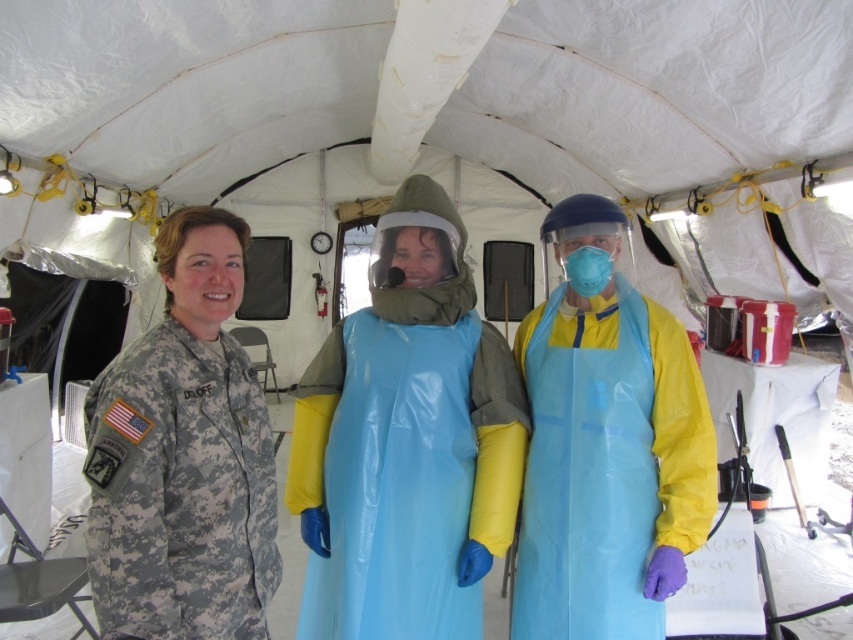
Who is positioned more to the right, blue plastic gown at center or camouflage uniform at left?

Positioned to the right is blue plastic gown at center.

In the scene shown: Who is more distant from viewer, [368,548] or [115,538]?

The point [368,548] is behind.

The height and width of the screenshot is (640, 853). I want to click on blue plastic gown at center, so click(x=405, y=464).

Does camouflage uniform at left appear under blue plastic apron at center?

No, camouflage uniform at left is not below blue plastic apron at center.

Which is above, camouflage uniform at left or blue plastic apron at center?

camouflage uniform at left is above.

You are a GUI agent. You are given a task and a screenshot of the screen. Output one action in this format:
    pyautogui.click(x=<x>, y=<y>)
    Task: Click on the camouflage uniform at left
    This screenshot has width=853, height=640.
    Given the screenshot: What is the action you would take?
    pyautogui.click(x=183, y=456)

This screenshot has height=640, width=853. Identify the location of camouflage uniform at left. (183, 456).

Who is positioned more to the left, camouflage uniform at left or blue matte face mask at center?

camouflage uniform at left

Does camouflage uniform at left have a larger size compared to blue matte face mask at center?

Yes.

Who is more forward, (210, 241) or (569, 278)?

Point (210, 241) is in front.

Locate an element on the screen. camouflage uniform at left is located at coordinates (183, 456).